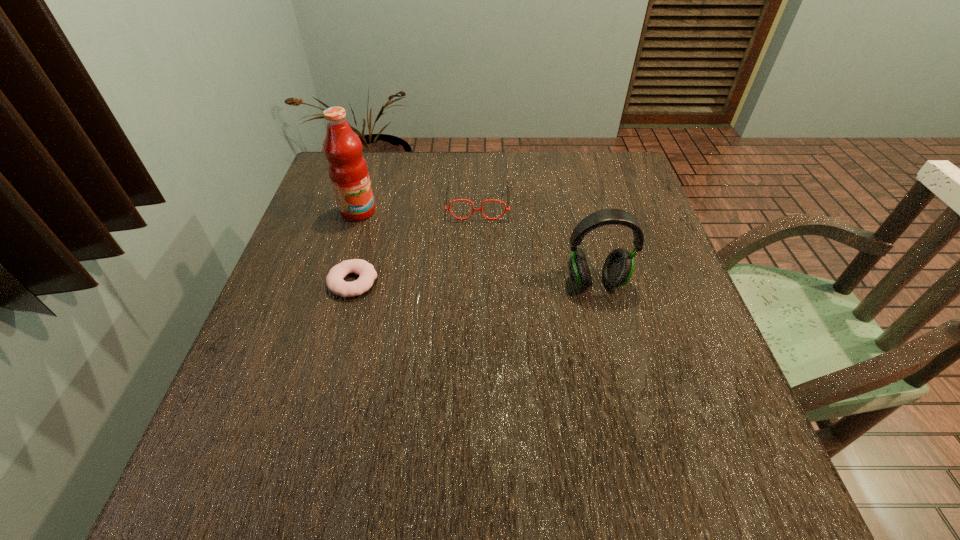
In order to click on the shortest object in this screenshot , I will do `click(334, 280)`.

Image resolution: width=960 pixels, height=540 pixels. What are the coordinates of `the rightmost object` in the screenshot? It's located at (618, 267).

Where is `the third shortest object`? This screenshot has height=540, width=960. the third shortest object is located at coordinates [x=618, y=267].

The width and height of the screenshot is (960, 540). Identify the location of the tallest object. (347, 168).

Identify the location of the second object from right to left. This screenshot has width=960, height=540. (448, 181).

Locate an element on the screen. Image resolution: width=960 pixels, height=540 pixels. spectacles is located at coordinates (448, 181).

Find the location of a particular element. vacant space located 0.390m on the right of the shortest object is located at coordinates (551, 282).

Find the location of a particular element. Image resolution: width=960 pixels, height=540 pixels. free space located 0.150m on the ear cups of the headset is located at coordinates (614, 353).

Find the location of a particular element. free space located 0.210m on the front label of the tallest object is located at coordinates (434, 248).

Find the location of a particular element. Image resolution: width=960 pixels, height=540 pixels. free space located 0.340m on the front label of the tallest object is located at coordinates (478, 269).